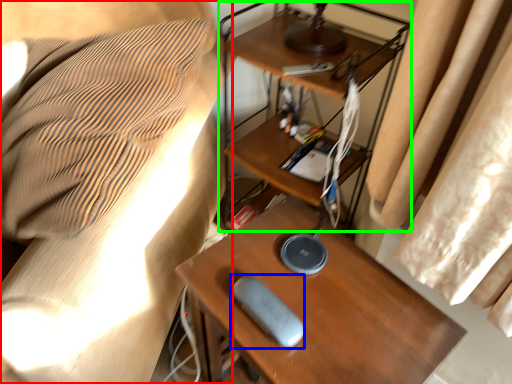
Question: Based on their relative distances, which object is nearer to furniture (highlighted by a red box)? Choose from equipment (highlighted by a blue box) and computer desk (highlighted by a green box).

Choices:
 (A) equipment
 (B) computer desk

Answer: (B)